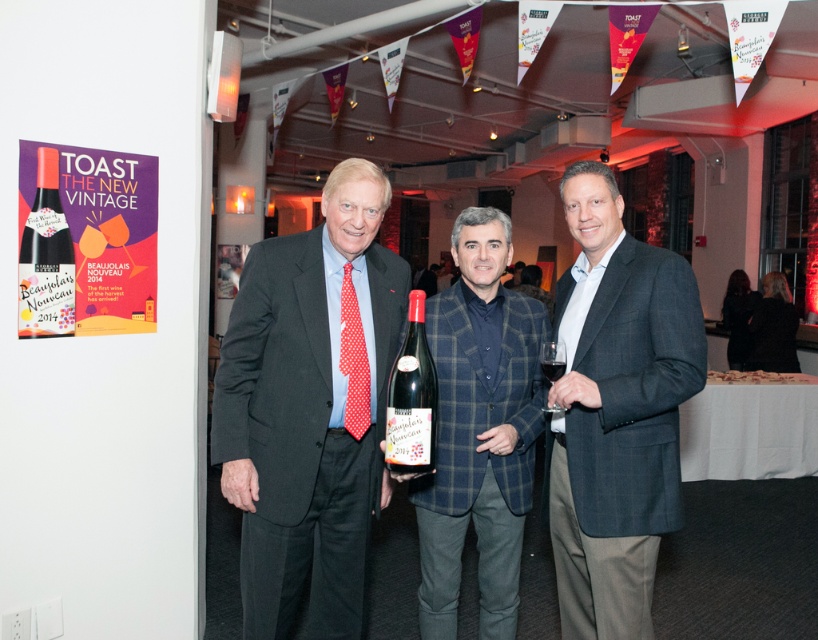
Question: Among these objects, which one is nearest to the camera?

Choices:
 (A) plaid wool blazer at center
 (B) matte black suit at center
 (C) dark gray textured blazer at center
 (D) transparent glass at center

Answer: (C)

Question: Which of the following is the closest to the observer?

Choices:
 (A) [x=560, y=364]
 (B) [x=326, y=342]
 (C) [x=547, y=349]
 (D) [x=636, y=280]

Answer: (A)

Question: Can you confirm if matte black wine bottle at upper left is smaller than matte glass bottle at center?

Choices:
 (A) yes
 (B) no

Answer: (A)

Question: Is matte black suit at center further to camera compared to transparent glass at center?

Choices:
 (A) yes
 (B) no

Answer: (A)

Question: Is plaid wool blazer at center closer to the viewer compared to matte glass bottle at center?

Choices:
 (A) yes
 (B) no

Answer: (B)

Question: Among these points, which one is farthest from the camera?

Choices:
 (A) (583, 204)
 (B) (293, 576)
 (C) (558, 356)

Answer: (B)